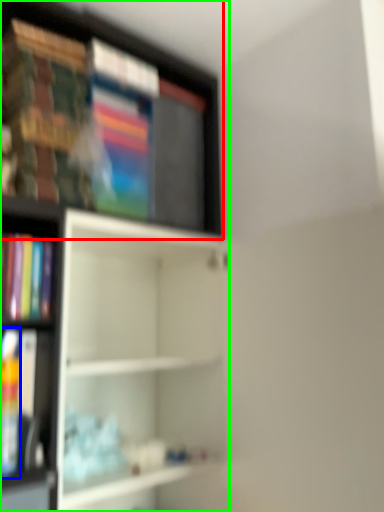
Question: Considering the real-world distances, which object is closest to shelf (highlighted by a red box)? book (highlighted by a blue box) or shelf (highlighted by a green box).

Choices:
 (A) book
 (B) shelf

Answer: (B)